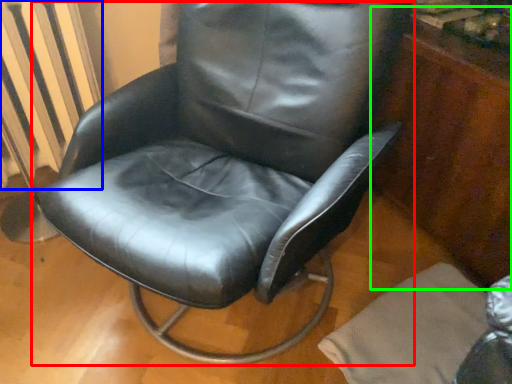
Question: Considering the real-world distances, which object is closest to chair (highlighted by a red box)? radiator (highlighted by a blue box) or dresser (highlighted by a green box).

Choices:
 (A) radiator
 (B) dresser

Answer: (A)